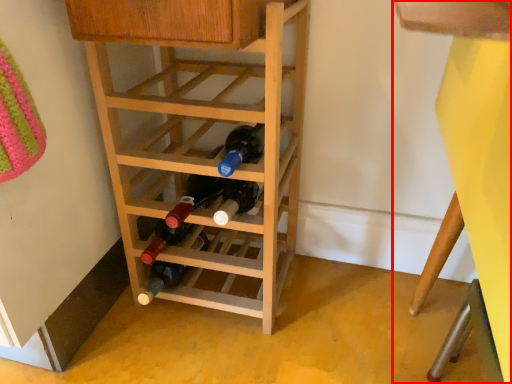
Question: From the image's perspective, what is the correct spatial relationship of bunk bed (annotated by the red box) in relation to shelf?

Choices:
 (A) above
 (B) below

Answer: (B)